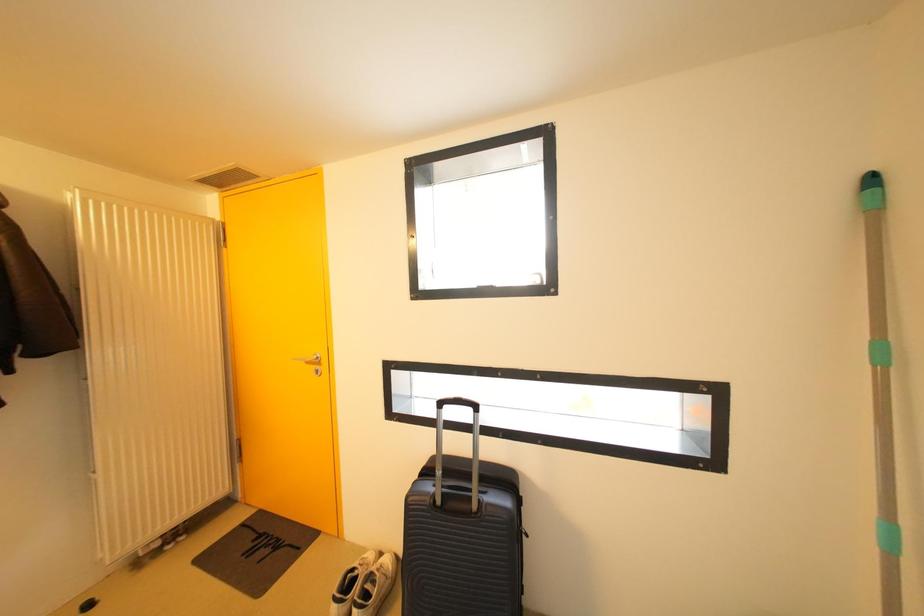
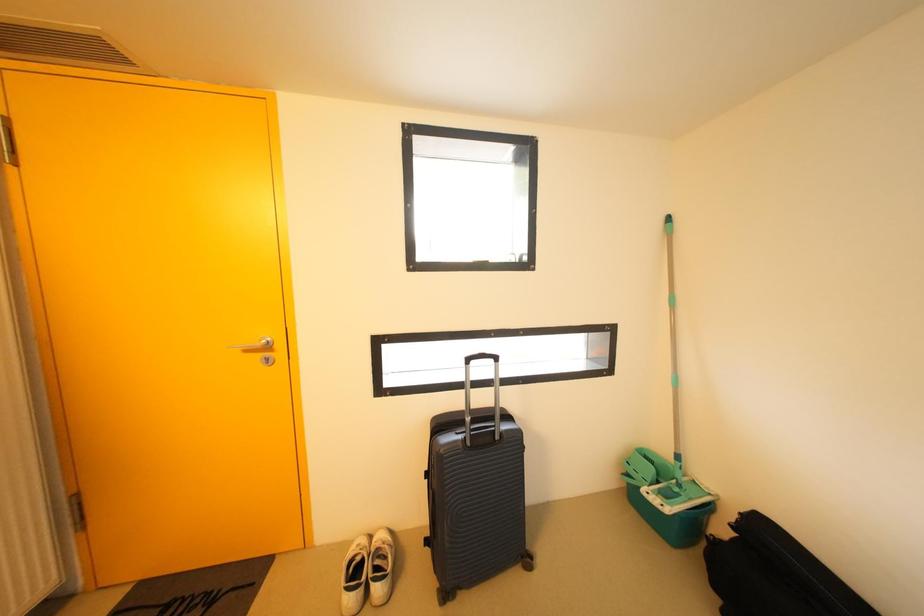
Question: The camera is either moving clockwise (left) or counter-clockwise (right) around the object. The first image is from the beginning of the video and the second image is from the end. Is the camera moving left or right when shooting the video?

Choices:
 (A) Left
 (B) Right

Answer: (A)